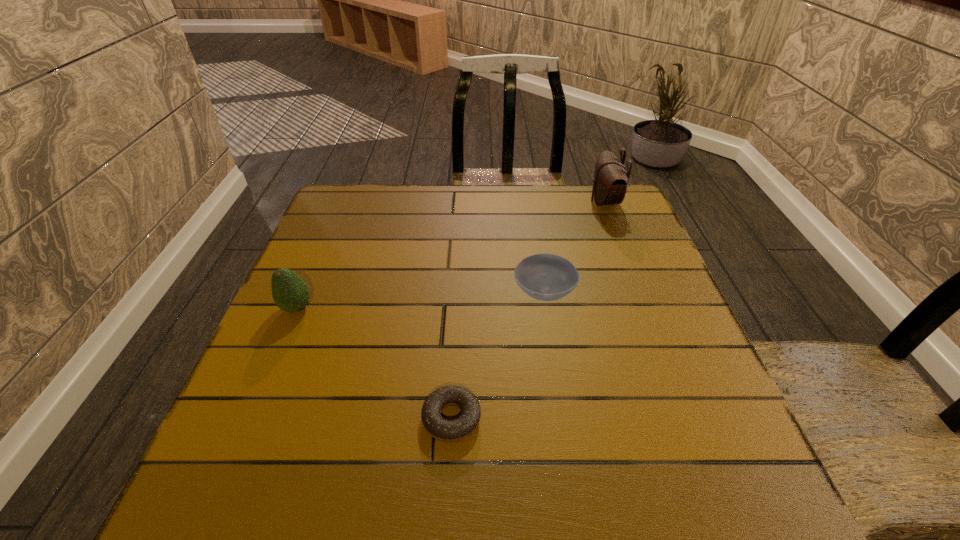
Where is `free location at the left edge`? The width and height of the screenshot is (960, 540). free location at the left edge is located at coordinates (316, 262).

Find the location of a particular element. The width and height of the screenshot is (960, 540). free spot at the right edge of the desktop is located at coordinates (684, 338).

In order to click on vacant space at the far right corner in this screenshot , I will do pos(591,220).

At what (x,y) coordinates should I click in order to perform the action: click on vacant area that lies between the third object from right to left and the leftmost object. Please return your answer as a coordinate pair (x, y). Image resolution: width=960 pixels, height=540 pixels. Looking at the image, I should click on (374, 363).

Where is `free space between the third object from left to right and the doughnut`? The image size is (960, 540). free space between the third object from left to right and the doughnut is located at coordinates (497, 356).

This screenshot has width=960, height=540. What are the coordinates of `vacant space that is in between the farthest object and the second object from left to right` in the screenshot? It's located at coord(528,310).

Image resolution: width=960 pixels, height=540 pixels. Identify the location of vacant point located between the avocado and the second object from right to left. (420, 301).

You are a GUI agent. You are given a task and a screenshot of the screen. Output one action in this format:
    pyautogui.click(x=<x>, y=<y>)
    Task: Click on the free space between the rightmost object and the third object from right to left
    This screenshot has width=960, height=540.
    Given the screenshot: What is the action you would take?
    pyautogui.click(x=528, y=310)

This screenshot has height=540, width=960. In order to click on empty space between the farthest object and the third object from right to left in this screenshot , I will do `click(528, 310)`.

Identify the location of vacant area that lies between the leftmost object and the rightmost object. The height and width of the screenshot is (540, 960). (450, 255).